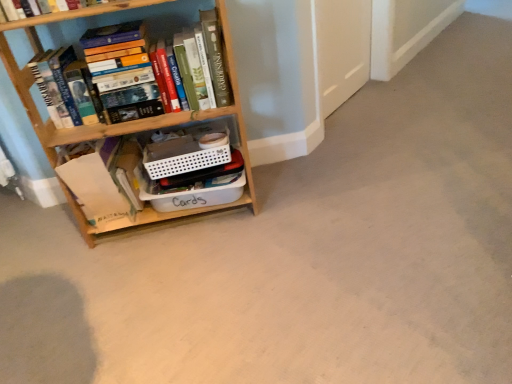
At what (x,y) coordinates should I click in order to perform the action: click on free space in front of wooden bookcase at left. Please return your answer as a coordinate pair (x, y). Looking at the image, I should click on (168, 286).